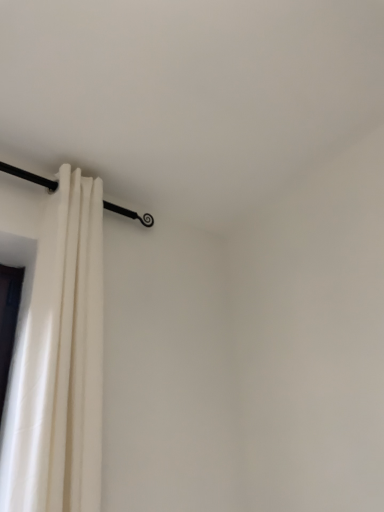
In order to face white fabric curtain at left, should I rotate leftwards or rightwards?

Rotate your view left by about 15.641°.

Describe the element at coordinates (63, 357) in the screenshot. I see `white fabric curtain at left` at that location.

Image resolution: width=384 pixels, height=512 pixels. Identify the location of white fabric curtain at left. (63, 357).

What is the approximate width of white fabric curtain at left?

5.84 inches.

Find the location of `white fabric curtain at left`. white fabric curtain at left is located at coordinates (63, 357).